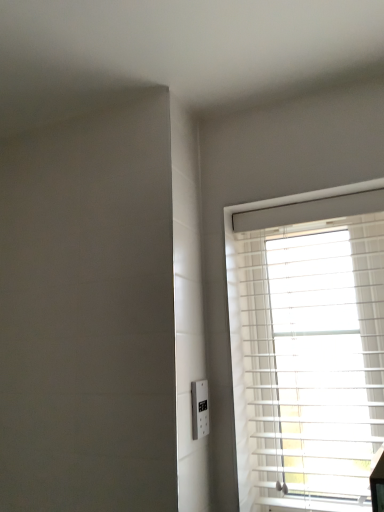
Identify the location of white plastic electric outlet at lower right. (200, 409).

What do you see at coordinates (200, 409) in the screenshot?
I see `white plastic electric outlet at lower right` at bounding box center [200, 409].

The height and width of the screenshot is (512, 384). In order to click on white plastic blinds at right in this screenshot , I will do `click(307, 350)`.

What is the approximate width of white plastic blinds at right?

white plastic blinds at right is 14.19 centimeters wide.

This screenshot has width=384, height=512. Describe the element at coordinates (307, 350) in the screenshot. I see `white plastic blinds at right` at that location.

Find the location of `white plastic electric outlet at lower right`. white plastic electric outlet at lower right is located at coordinates (200, 409).

Is white plastic blinds at right to the left of white plastic electric outlet at lower right from the viewer's perspective?

Incorrect, white plastic blinds at right is not on the left side of white plastic electric outlet at lower right.

In the scene shown: Considering their positions, is white plastic blinds at right located in front of or behind white plastic electric outlet at lower right?

Visually, white plastic blinds at right is located in front of white plastic electric outlet at lower right.

Which is in front, point (273, 506) or point (202, 432)?

Positioned in front is point (202, 432).

From the image's perspective, is white plastic blinds at right positioned above or below white plastic electric outlet at lower right?

white plastic blinds at right is above white plastic electric outlet at lower right.

From a real-world perspective, which is physically below, white plastic blinds at right or white plastic electric outlet at lower right?

white plastic electric outlet at lower right is physically lower.

Does white plastic blinds at right have a lesser width compared to white plastic electric outlet at lower right?

In fact, white plastic blinds at right might be wider than white plastic electric outlet at lower right.

Can you confirm if white plastic blinds at right is taller than white plastic electric outlet at lower right?

Indeed, white plastic blinds at right has a greater height compared to white plastic electric outlet at lower right.

In terms of size, does white plastic blinds at right appear bigger or smaller than white plastic electric outlet at lower right?

Considering their sizes, white plastic blinds at right takes up more space than white plastic electric outlet at lower right.

Choose the correct answer: Is white plastic blinds at right inside white plastic electric outlet at lower right or outside it?

white plastic blinds at right is not enclosed by white plastic electric outlet at lower right.

Are white plastic blinds at right and white plastic electric outlet at lower right far apart?

That's not correct — white plastic blinds at right is a little close to white plastic electric outlet at lower right.

Is white plastic electric outlet at lower right at the back of white plastic blinds at right?

No, white plastic blinds at right is not facing away from white plastic electric outlet at lower right.

How different are the orientations of white plastic blinds at right and white plastic electric outlet at lower right in degrees?

They differ by 91.1 degrees in their facing directions.

There is a white plastic electric outlet at lower right. Identify the location of window above it (from a real-world perspective). (307, 350).

Considering the positions of objects white plastic electric outlet at lower right and white plastic blinds at right in the image provided, who is more to the right, white plastic electric outlet at lower right or white plastic blinds at right?

Positioned to the right is white plastic blinds at right.

Between white plastic electric outlet at lower right and white plastic blinds at right, which one is positioned in front?

white plastic blinds at right is closer to the camera.

Does point (193, 418) come farther from viewer compared to point (371, 401)?

No, (193, 418) is in front of (371, 401).

From the image's perspective, which is above, white plastic electric outlet at lower right or white plastic blinds at right?

white plastic blinds at right is shown above in the image.

From a real-world perspective, which is physically below, white plastic electric outlet at lower right or white plastic blinds at right?

In real-world perspective, white plastic electric outlet at lower right is lower.

Can you confirm if white plastic electric outlet at lower right is thinner than white plastic blinds at right?

Yes, white plastic electric outlet at lower right is thinner than white plastic blinds at right.

Between white plastic electric outlet at lower right and white plastic blinds at right, which one has less height?

white plastic electric outlet at lower right is shorter.

Who is bigger, white plastic electric outlet at lower right or white plastic blinds at right?

Bigger between the two is white plastic blinds at right.

Is white plastic blinds at right located within white plastic electric outlet at lower right?

Definitely not — white plastic blinds at right is not inside white plastic electric outlet at lower right.

Is white plastic electric outlet at lower right placed right next to white plastic blinds at right?

Result: There is a gap between white plastic electric outlet at lower right and white plastic blinds at right.

Is white plastic electric outlet at lower right facing towards white plastic blinds at right?

No, white plastic electric outlet at lower right is not turned towards white plastic blinds at right.

Locate an element on the screen. The image size is (384, 512). electric outlet that is below the white plastic blinds at right (from the image's perspective) is located at coordinates (200, 409).

Image resolution: width=384 pixels, height=512 pixels. What are the coordinates of `electric outlet on the left of white plastic blinds at right` in the screenshot? It's located at (200, 409).

I want to click on window positioned vertically above the white plastic electric outlet at lower right (from a real-world perspective), so coord(307,350).